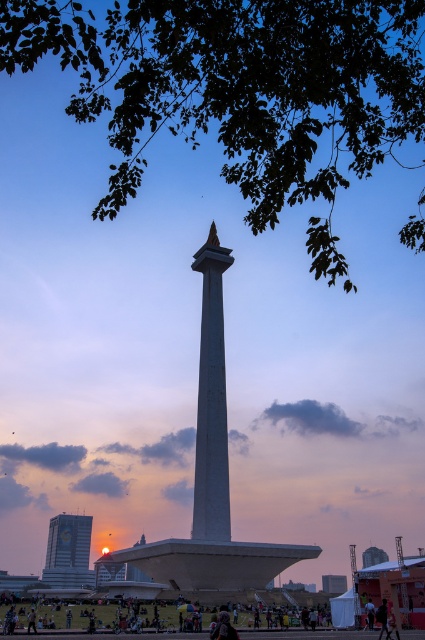
Question: Which of the following is the farthest from the observer?

Choices:
 (A) matte glass building at lower left
 (B) green leafy tree at upper center

Answer: (A)

Question: Is white marble obelisk at center bigger than dark clothing at lower center?

Choices:
 (A) no
 (B) yes

Answer: (A)

Question: Where is white concrete tower at center located in relation to dark blue fabric at center in the image?

Choices:
 (A) below
 (B) above

Answer: (A)

Question: Estimate the real-world distances between objects in this image. Which object is closer to the matte glass building at lower left?

Choices:
 (A) white marble obelisk at center
 (B) white concrete tower at center
 (C) green leafy tree at upper center
 (D) white stone tower at center

Answer: (D)

Question: Which object appears farthest from the camera in this image?

Choices:
 (A) white concrete tower at center
 (B) matte glass building at lower left
 (C) dark blue fabric at center

Answer: (A)

Question: Can you confirm if white marble obelisk at center is wider than dark clothing at lower center?

Choices:
 (A) no
 (B) yes

Answer: (A)